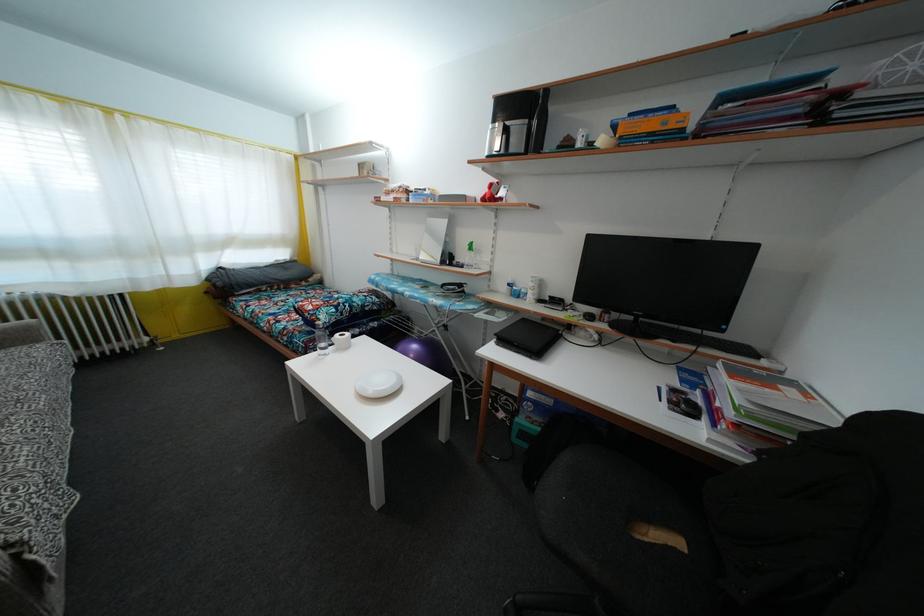
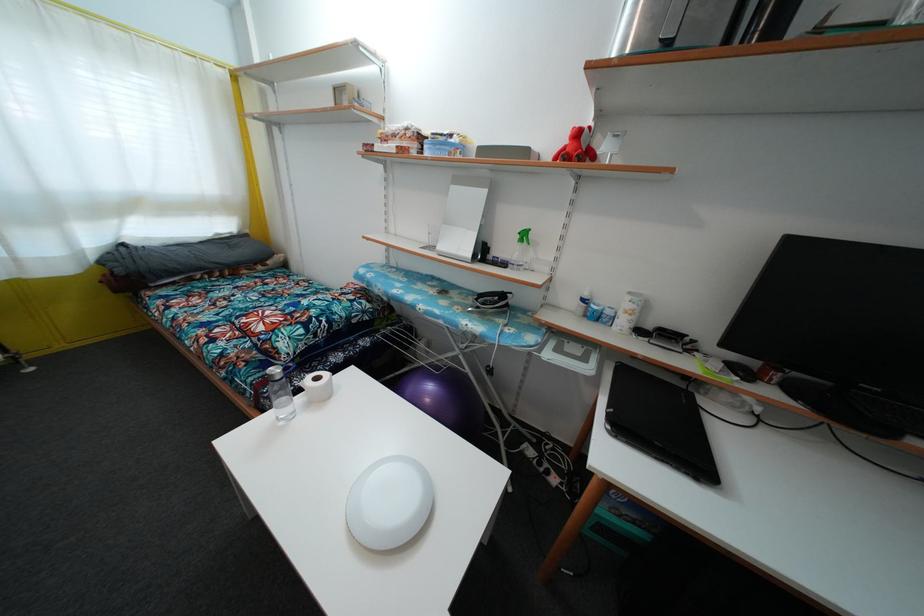
Question: How did the camera likely rotate?

Choices:
 (A) Left
 (B) Right
 (C) Up
 (D) Down

Answer: (D)